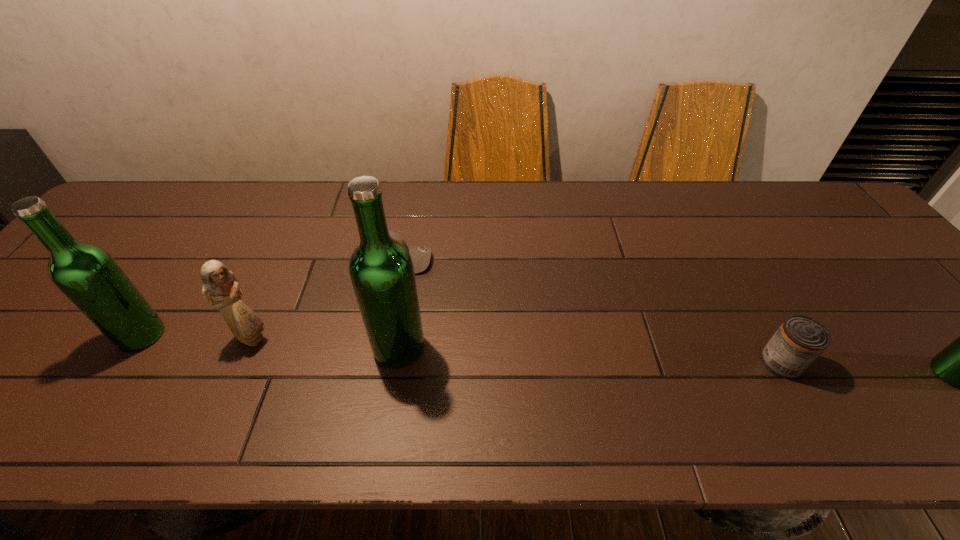
Select which beer bottle is the third closest to the figurine. Please provide its 2D coordinates. Your answer should be formatted as a tuple, i.e. [(x, y)], where the tuple contains the x and y coordinates of a point satisfying the conditions above.

[(959, 364)]

Point out which beer bottle is positioned as the nearest to the can. Please provide its 2D coordinates. Your answer should be formatted as a tuple, i.e. [(x, y)], where the tuple contains the x and y coordinates of a point satisfying the conditions above.

[(959, 364)]

The image size is (960, 540). I want to click on vacant area that satisfies the following two spatial constraints: 1. on the front brim of the farthest object; 2. on the back side of the second beer bottle from left to right, so click(x=377, y=347).

In order to click on free region that satisfies the following two spatial constraints: 1. on the back side of the fifth object from left to right; 2. on the front brim of the baseball cap in this screenshot , I will do `click(725, 260)`.

The height and width of the screenshot is (540, 960). What are the coordinates of `blank area in the image that satisfies the following two spatial constraints: 1. on the front-facing side of the fifth object from right to left; 2. on the right side of the second beer bottle from left to right` in the screenshot? It's located at (249, 347).